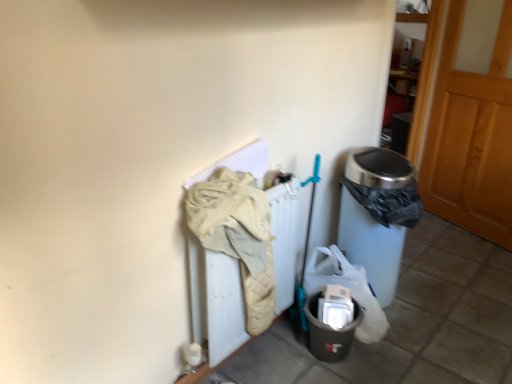
Question: Can you confirm if wooden at right is positioned to the left of matte gray plastic bin at lower right?

Choices:
 (A) no
 (B) yes

Answer: (A)

Question: Is wooden at right behind matte gray plastic bin at lower right?

Choices:
 (A) no
 (B) yes

Answer: (B)

Question: Is wooden at right outside of matte gray plastic bin at lower right?

Choices:
 (A) yes
 (B) no

Answer: (A)

Question: Considering the relative sizes of wooden at right and matte gray plastic bin at lower right in the image provided, is wooden at right wider than matte gray plastic bin at lower right?

Choices:
 (A) no
 (B) yes

Answer: (A)

Question: Does wooden at right have a lesser width compared to matte gray plastic bin at lower right?

Choices:
 (A) yes
 (B) no

Answer: (A)

Question: Considering the positions of point (329, 360) and point (209, 192), is point (329, 360) closer or farther from the camera than point (209, 192)?

Choices:
 (A) farther
 (B) closer

Answer: (A)

Question: Is matte gray plastic bin at lower right inside the boundaries of beige quilted blanket at center-left, or outside?

Choices:
 (A) inside
 (B) outside

Answer: (B)

Question: Considering the relative positions of matte gray plastic bin at lower right and beige quilted blanket at center-left in the image provided, is matte gray plastic bin at lower right to the left or to the right of beige quilted blanket at center-left?

Choices:
 (A) left
 (B) right

Answer: (B)

Question: Is matte gray plastic bin at lower right bigger or smaller than beige quilted blanket at center-left?

Choices:
 (A) small
 (B) big

Answer: (A)

Question: From a real-world perspective, is wooden at right above or below matte gray plastic bin at lower right?

Choices:
 (A) above
 (B) below

Answer: (A)

Question: Is wooden at right to the left or to the right of matte gray plastic bin at lower right in the image?

Choices:
 (A) right
 (B) left

Answer: (A)

Question: Considering their positions, is wooden at right located in front of or behind matte gray plastic bin at lower right?

Choices:
 (A) behind
 (B) front

Answer: (A)

Question: Does point (454, 135) appear closer or farther from the camera than point (334, 342)?

Choices:
 (A) closer
 (B) farther

Answer: (B)

Question: Relative to matte gray plastic bin at lower right, is beige quilted blanket at center-left in front or behind?

Choices:
 (A) front
 (B) behind

Answer: (A)

Question: Is beige quilted blanket at center-left wider or thinner than matte gray plastic bin at lower right?

Choices:
 (A) wide
 (B) thin

Answer: (B)